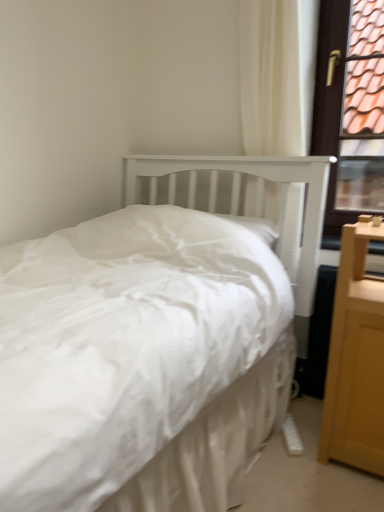
Question: Is brown wooden window frame at upper right taller than light wood nightstand at right?

Choices:
 (A) no
 (B) yes

Answer: (B)

Question: Does brown wooden window frame at upper right have a greater width compared to light wood nightstand at right?

Choices:
 (A) yes
 (B) no

Answer: (B)

Question: From the image's perspective, is brown wooden window frame at upper right below light wood nightstand at right?

Choices:
 (A) yes
 (B) no

Answer: (B)

Question: Would you say brown wooden window frame at upper right is outside light wood nightstand at right?

Choices:
 (A) no
 (B) yes

Answer: (B)

Question: From the image's perspective, would you say brown wooden window frame at upper right is positioned over light wood nightstand at right?

Choices:
 (A) yes
 (B) no

Answer: (A)

Question: Is brown wooden window frame at upper right not close to light wood nightstand at right?

Choices:
 (A) yes
 (B) no

Answer: (A)

Question: Does light wood nightstand at right come in front of brown wooden window frame at upper right?

Choices:
 (A) yes
 (B) no

Answer: (A)

Question: Is light wood nightstand at right directly adjacent to brown wooden window frame at upper right?

Choices:
 (A) yes
 (B) no

Answer: (B)

Question: Is light wood nightstand at right to the right of brown wooden window frame at upper right from the viewer's perspective?

Choices:
 (A) no
 (B) yes

Answer: (A)

Question: Can you confirm if light wood nightstand at right is positioned to the left of brown wooden window frame at upper right?

Choices:
 (A) yes
 (B) no

Answer: (A)

Question: From the image's perspective, would you say light wood nightstand at right is shown under brown wooden window frame at upper right?

Choices:
 (A) no
 (B) yes

Answer: (B)

Question: Does light wood nightstand at right contain brown wooden window frame at upper right?

Choices:
 (A) yes
 (B) no

Answer: (B)

Question: Is point tap(354, 407) closer or farther from the camera than point tap(324, 105)?

Choices:
 (A) closer
 (B) farther

Answer: (A)